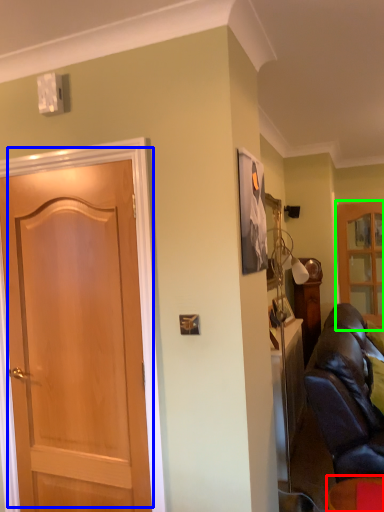
Question: Considering the real-world distances, which object is closest to furniture (highlighted by a red box)? door (highlighted by a blue box) or cabinetry (highlighted by a green box).

Choices:
 (A) door
 (B) cabinetry

Answer: (A)